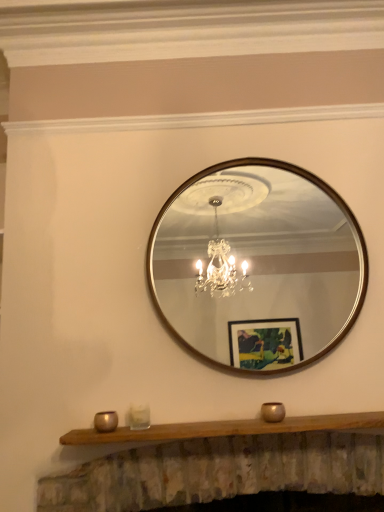
Question: Does metallic gold candle holder at lower center, arranged as the third candle holder when viewed from the right, appear on the right side of wooden-framed mirror at center?

Choices:
 (A) yes
 (B) no

Answer: (B)

Question: Can you confirm if metallic gold candle holder at lower center, which is the 1th candle holder in left-to-right order, is positioned to the left of wooden-framed mirror at center?

Choices:
 (A) no
 (B) yes

Answer: (B)

Question: Can you confirm if metallic gold candle holder at lower center, which is the 1th candle holder in left-to-right order, is taller than wooden-framed mirror at center?

Choices:
 (A) yes
 (B) no

Answer: (B)

Question: From a real-world perspective, is metallic gold candle holder at lower center, arranged as the third candle holder when viewed from the right, positioned under wooden-framed mirror at center based on gravity?

Choices:
 (A) yes
 (B) no

Answer: (A)

Question: Is metallic gold candle holder at lower center, which is the 1th candle holder in left-to-right order, touching wooden-framed mirror at center?

Choices:
 (A) no
 (B) yes

Answer: (A)

Question: Can you confirm if metallic gold candle holder at lower center, which is the 1th candle holder in left-to-right order, is smaller than wooden-framed mirror at center?

Choices:
 (A) no
 (B) yes

Answer: (B)

Question: Can you confirm if wooden-framed mirror at center is bigger than wooden mantle at center?

Choices:
 (A) no
 (B) yes

Answer: (B)

Question: Considering the relative sizes of wooden-framed mirror at center and wooden mantle at center in the image provided, is wooden-framed mirror at center taller than wooden mantle at center?

Choices:
 (A) no
 (B) yes

Answer: (B)

Question: Is wooden-framed mirror at center oriented away from wooden mantle at center?

Choices:
 (A) no
 (B) yes

Answer: (A)

Question: Is wooden-framed mirror at center wider than wooden mantle at center?

Choices:
 (A) no
 (B) yes

Answer: (A)

Question: Does wooden-framed mirror at center appear on the right side of wooden mantle at center?

Choices:
 (A) yes
 (B) no

Answer: (A)

Question: Is wooden-framed mirror at center located outside wooden mantle at center?

Choices:
 (A) yes
 (B) no

Answer: (A)

Question: From a real-world perspective, is wooden mantle at center on top of clear glass candle holder at lower center, which is counted as the 2th candle holder, starting from the right?

Choices:
 (A) yes
 (B) no

Answer: (B)